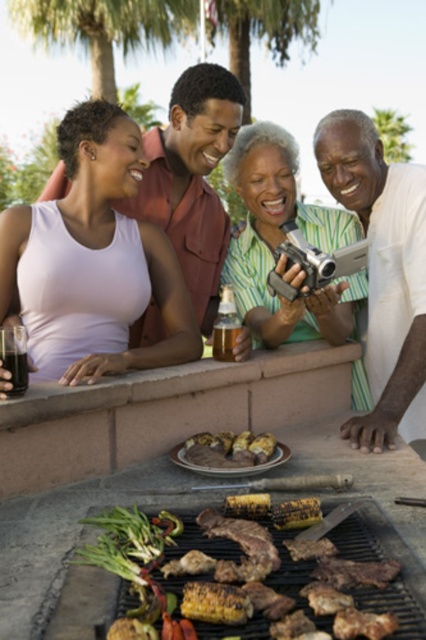
Question: Can you confirm if white cotton shirt at upper right is positioned below charred yellow corn at center?

Choices:
 (A) no
 (B) yes

Answer: (A)

Question: Among these objects, which one is farthest from the camera?

Choices:
 (A) translucent glass beverage at grill
 (B) matte pink tank top at left
 (C) grilled meat at center
 (D) white cotton shirt at upper right

Answer: (A)

Question: Which point appears farthest from the camera in this image?

Choices:
 (A) (374, 298)
 (B) (259, 451)

Answer: (A)

Question: Which of the following is the closest to the observer?

Choices:
 (A) (339, 244)
 (B) (236, 337)
 (C) (14, 365)

Answer: (C)

Question: Is white cotton shirt at upper right behind black glass beverage at lower left?

Choices:
 (A) yes
 (B) no

Answer: (A)

Question: Does green matte camera at center appear on the left side of translucent glass beverage at grill?

Choices:
 (A) yes
 (B) no

Answer: (B)